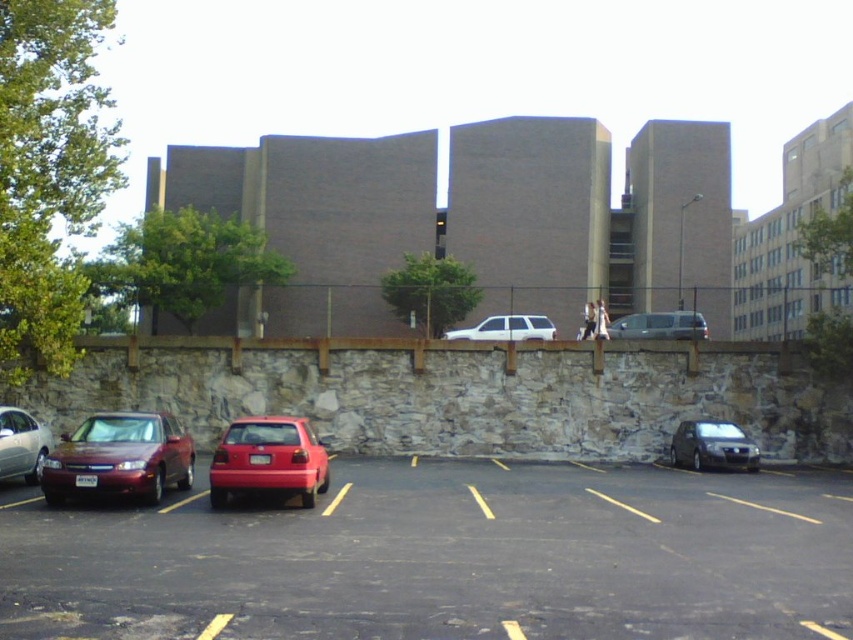
Question: Which of the following is the closest to the observer?

Choices:
 (A) satin silver van at center-right
 (B) white matte suv at center

Answer: (B)

Question: Which of the following is the closest to the observer?

Choices:
 (A) white matte suv at center
 (B) shiny red sedan at left
 (C) metallic silver sedan at lower right
 (D) smooth asphalt parking lot at lower center

Answer: (D)

Question: Is glossy red hatchback at center to the right of white matte suv at center from the viewer's perspective?

Choices:
 (A) yes
 (B) no

Answer: (B)

Question: Does glossy red hatchback at center lie behind shiny silver sedan at left?

Choices:
 (A) no
 (B) yes

Answer: (A)

Question: Does glossy red hatchback at center come in front of white matte suv at center?

Choices:
 (A) no
 (B) yes

Answer: (B)

Question: Among these objects, which one is nearest to the camera?

Choices:
 (A) glossy red hatchback at center
 (B) metallic silver sedan at lower right
 (C) shiny silver sedan at left

Answer: (A)